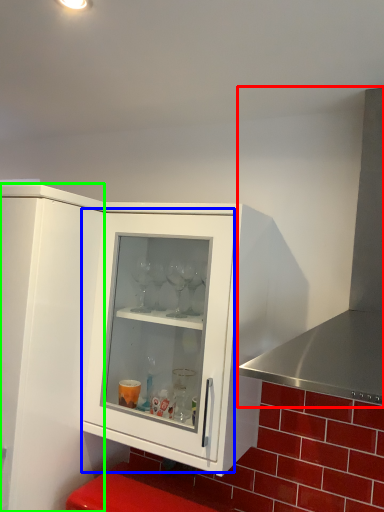
Question: Which object is the farthest from exhaust hood (highlighted by a red box)? Choose among these: glass door (highlighted by a blue box) or cupboard (highlighted by a green box).

Choices:
 (A) glass door
 (B) cupboard

Answer: (B)